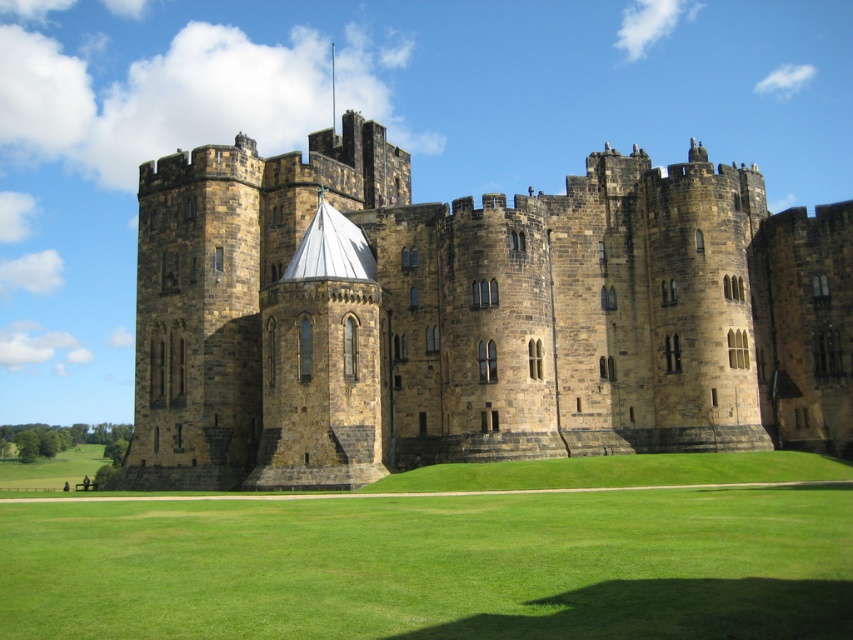
Can you confirm if brown stone castle at center is positioned to the left of green grass at center?

No, brown stone castle at center is not to the left of green grass at center.

Is brown stone castle at center taller than green grass at center?

Yes, brown stone castle at center is taller than green grass at center.

Does point (306, 429) come in front of point (830, 518)?

That is False.

In order to click on brown stone castle at center in this screenshot , I will do `click(473, 316)`.